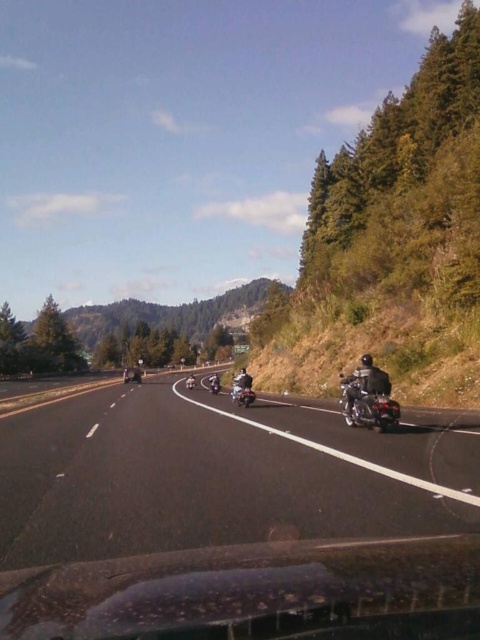
Question: Is black asphalt road at center below shiny chrome motorcycle at right?

Choices:
 (A) yes
 (B) no

Answer: (A)

Question: Which point is closer to the camera?

Choices:
 (A) (372, 390)
 (B) (370, 403)

Answer: (B)

Question: Which point is farther to the camera?

Choices:
 (A) (383, 388)
 (B) (224, 532)
 (C) (251, 388)
 (D) (408, 550)

Answer: (C)

Question: Does transparent glass windshield at lower center appear under shiny silver motorcycle at center?

Choices:
 (A) no
 (B) yes

Answer: (A)

Question: Is black asphalt road at center below shiny chrome motorcycle at right?

Choices:
 (A) yes
 (B) no

Answer: (A)

Question: Among these objects, which one is farthest from the camera?

Choices:
 (A) black asphalt road at center
 (B) shiny chrome motorcycle at center

Answer: (B)